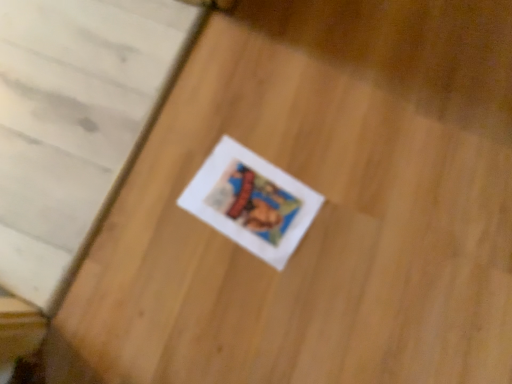
This screenshot has height=384, width=512. Find the location of `free point above white wood stairs at upper left (from a real-world perspective)`. free point above white wood stairs at upper left (from a real-world perspective) is located at coordinates [x=65, y=94].